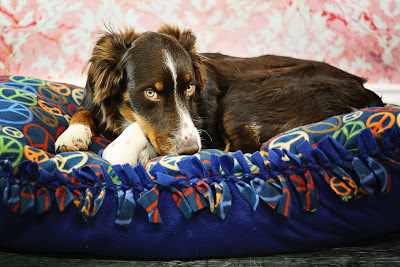
I want to click on dog bed, so click(x=195, y=195).